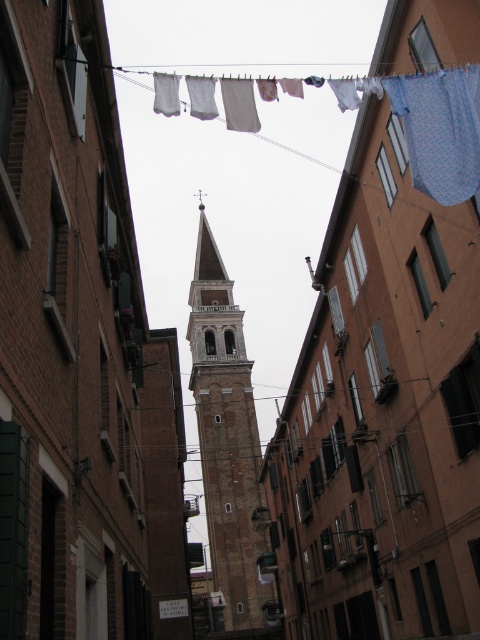
Can you confirm if light brown stone tower at center is taller than blue printed fabric at upper right?

Yes, light brown stone tower at center is taller than blue printed fabric at upper right.

Is light brown stone tower at center closer to camera compared to blue printed fabric at upper right?

That is False.

Does point (228, 304) come in front of point (432, 172)?

That is False.

Find the location of a particular element. The width and height of the screenshot is (480, 640). light brown stone tower at center is located at coordinates (228, 445).